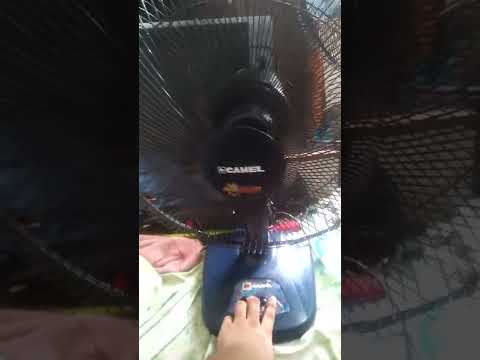
This screenshot has height=360, width=480. Find the location of `black base of oscillating fan, bottom center`. black base of oscillating fan, bottom center is located at coordinates (292, 265), (215, 270), (293, 303), (208, 304), (176, 342).